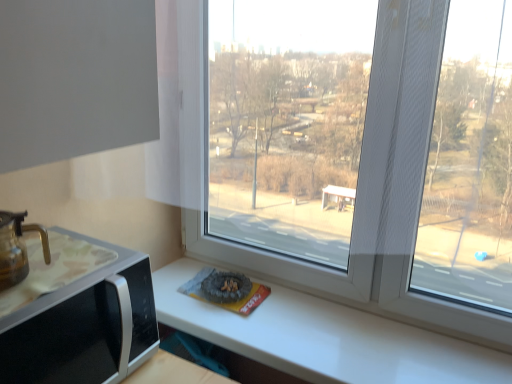
Where is `blank space situated above black plastic microwave at lower left (from a real-world perspective)`? The height and width of the screenshot is (384, 512). blank space situated above black plastic microwave at lower left (from a real-world perspective) is located at coordinates (60, 272).